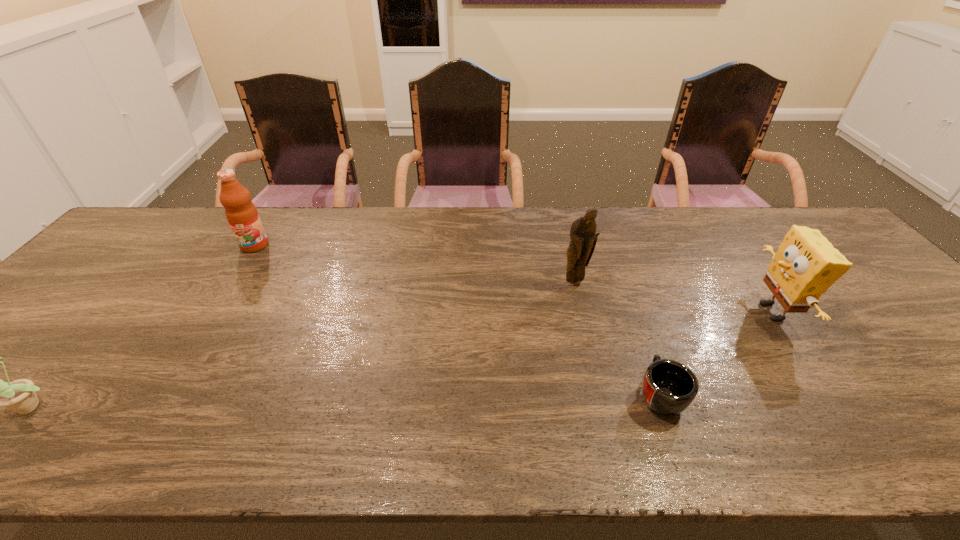
Where is `the farthest object`? This screenshot has width=960, height=540. the farthest object is located at coordinates (242, 215).

This screenshot has height=540, width=960. In order to click on fruit juice in this screenshot , I will do `click(242, 215)`.

Locate an element on the screen. figurine is located at coordinates (582, 233).

The width and height of the screenshot is (960, 540). What are the coordinates of `the rightmost object` in the screenshot? It's located at (806, 264).

Where is `the fourth object from left to right`? This screenshot has width=960, height=540. the fourth object from left to right is located at coordinates (669, 387).

This screenshot has height=540, width=960. I want to click on mug, so click(669, 387).

Locate an element on the screen. Image resolution: width=960 pixels, height=540 pixels. vacant space located on the front label of the fourth object from right to left is located at coordinates (200, 332).

Locate an element on the screen. This screenshot has width=960, height=540. vacant space located on the front-facing side of the third object from right to left is located at coordinates (581, 309).

This screenshot has width=960, height=540. Find the location of `vacant region located on the face of the rightmost object`. vacant region located on the face of the rightmost object is located at coordinates (661, 312).

The image size is (960, 540). What are the coordinates of `free region located on the face of the rightmost object` in the screenshot? It's located at (716, 312).